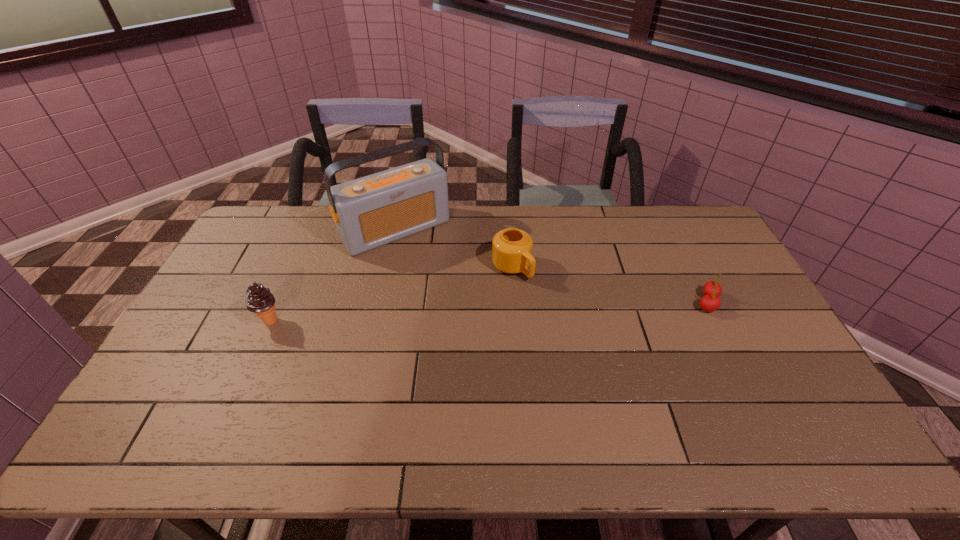
Where is `vacant area at the left edge of the desktop`? vacant area at the left edge of the desktop is located at coordinates (189, 352).

Where is `vacant space at the right edge of the desktop`? The image size is (960, 540). vacant space at the right edge of the desktop is located at coordinates (739, 335).

This screenshot has height=540, width=960. What are the coordinates of `free space at the far left corner of the desktop` in the screenshot? It's located at (294, 225).

What are the coordinates of `free space at the far right corner of the desktop` in the screenshot? It's located at (716, 238).

You are a GUI agent. You are given a task and a screenshot of the screen. Output one action in this format:
    pyautogui.click(x=<x>, y=<y>)
    Task: Click on the empty space between the third object from left to right and the leftmost object
    
    Given the screenshot: What is the action you would take?
    pyautogui.click(x=391, y=294)

Find the location of a particular element. free area in between the shortest object and the second shortest object is located at coordinates (610, 285).

Identify the location of blank region between the third object from left to right and the second tallest object. (391, 294).

Image resolution: width=960 pixels, height=540 pixels. What are the coordinates of `free point between the icecream and the rightmost object` in the screenshot? It's located at (489, 312).

Where is `unoccupied area between the second shortest object and the shortest object`? unoccupied area between the second shortest object and the shortest object is located at coordinates (610, 285).

The image size is (960, 540). What are the coordinates of `free space between the tallest object and the icecream` in the screenshot? It's located at coord(333,275).